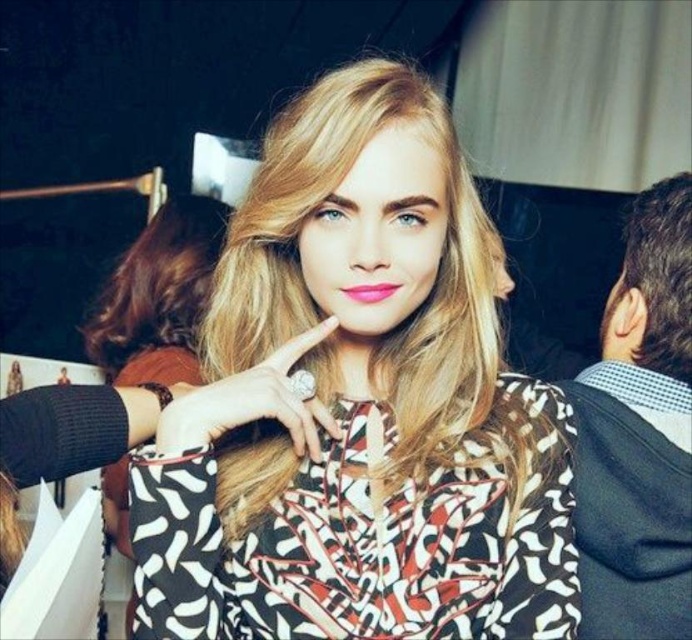
Question: Which object appears farthest from the camera in this image?

Choices:
 (A) blonde silky hair at upper left
 (B) dark brown curly hair at right
 (C) printed fabric blouse at center

Answer: (A)

Question: Does printed fabric blouse at center appear on the right side of printed fabric dress at center?

Choices:
 (A) no
 (B) yes

Answer: (A)

Question: Among these objects, which one is farthest from the camera?

Choices:
 (A) printed fabric blouse at center
 (B) black textured hoodie at right

Answer: (B)

Question: Which object is closer to the camera taking this photo?

Choices:
 (A) blonde silky hair at upper left
 (B) printed fabric blouse at center

Answer: (B)

Question: Is printed fabric blouse at center further to the viewer compared to matte pink lipstick at center?

Choices:
 (A) yes
 (B) no

Answer: (B)

Question: Is printed fabric blouse at center below printed fabric dress at center?

Choices:
 (A) yes
 (B) no

Answer: (B)